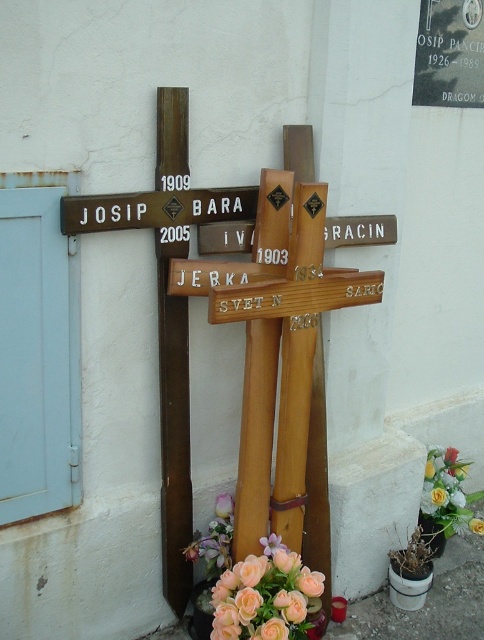
You are standing in front of the cluster of wooden crosses on the wall. You need to place a new memorial plaque exactly where the brown wooden sign at center is currently located. According to the coordinates provided, where should you position the new plaque?

The brown wooden sign at center is located at point coordinates (155, 209), so you should position the new plaque at those exact coordinates.

You are standing in front of the cluster of wooden crosses mounted against a white wall. You notice a wooden cross at center located at point (360, 230). Can you determine which cross is positioned at that exact coordinate?

The wooden cross at center is positioned at point (360, 230).

You are an interior designer planning to hang a new picture on the wall where the pink matte flower at center is located. The picture frame you have is 30 cm wide. Can you place it without overlapping any crosses?

The pink matte flower at center is located at point [272,545]. Since the crosses are all mounted on the wall and the flower is at a specific coordinate, you need to ensure the new picture frame does not overlap any crosses. However, without knowing the exact dimensions and spacing between the crosses, it is impossible to determine if the 30 cm wide frame can be placed safely without overlapping. Consider measuring the available space between the crosses first.